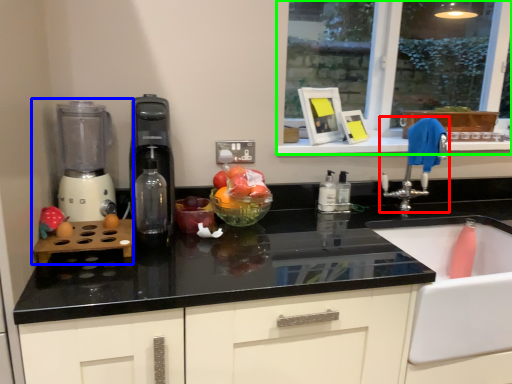
Question: Considering the real-world distances, which object is farthest from tap (highlighted by a red box)? mixer (highlighted by a blue box) or window (highlighted by a green box)?

Choices:
 (A) mixer
 (B) window

Answer: (B)